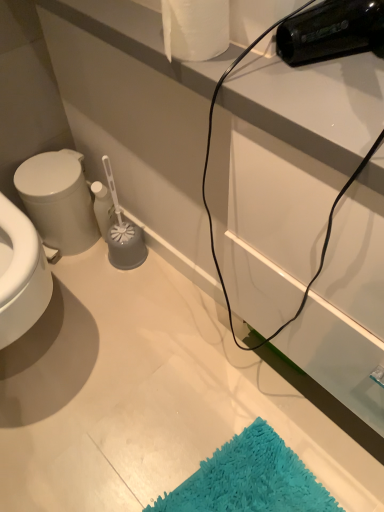
You are a GUI agent. You are given a task and a screenshot of the screen. Output one action in this format:
    pyautogui.click(x=<x>, y=<y>)
    Task: Click on the free space in front of white matte toilet paper at upper center
    The height and width of the screenshot is (512, 384).
    Given the screenshot: What is the action you would take?
    (x=254, y=87)